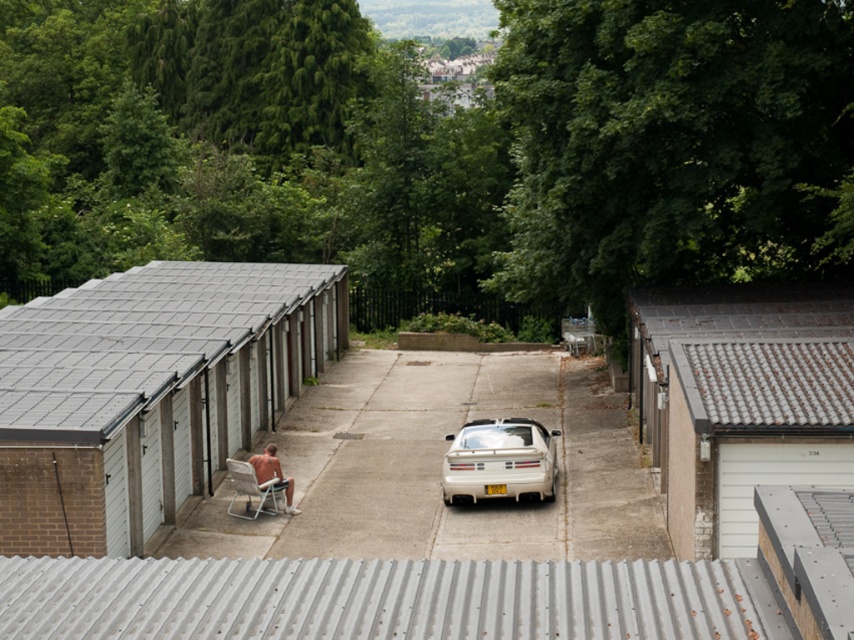
Does white matte shed at left lie behind white matte car at center?

No, white matte shed at left is in front of white matte car at center.

Is white matte shed at left shorter than white matte car at center?

In fact, white matte shed at left may be taller than white matte car at center.

Does point (249, 356) lie behind point (379, 401)?

No, (249, 356) is closer to viewer.

Where is `white matte shed at left`? This screenshot has height=640, width=854. white matte shed at left is located at coordinates (148, 392).

At what (x,y) coordinates should I click in order to perform the action: click on white matte shed at left. Please return your answer as a coordinate pair (x, y). This screenshot has width=854, height=640. Looking at the image, I should click on (148, 392).

Does white matte shed at left appear on the left side of nude skin at lower left?

Correct, you'll find white matte shed at left to the left of nude skin at lower left.

Describe the element at coordinates (148, 392) in the screenshot. This screenshot has height=640, width=854. I see `white matte shed at left` at that location.

The width and height of the screenshot is (854, 640). What are the coordinates of `white matte shed at left` in the screenshot? It's located at pos(148,392).

Which is more to the right, white glossy car at center or nude skin at lower left?

white glossy car at center is more to the right.

Does white glossy car at center appear on the right side of nude skin at lower left?

Indeed, white glossy car at center is positioned on the right side of nude skin at lower left.

Is point (504, 492) farther from viewer compared to point (285, 490)?

No, it is in front of (285, 490).

You are a GUI agent. You are given a task and a screenshot of the screen. Output one action in this format:
    pyautogui.click(x=<x>, y=<y>)
    Task: Click on the white glossy car at center
    
    Given the screenshot: What is the action you would take?
    pos(499,460)